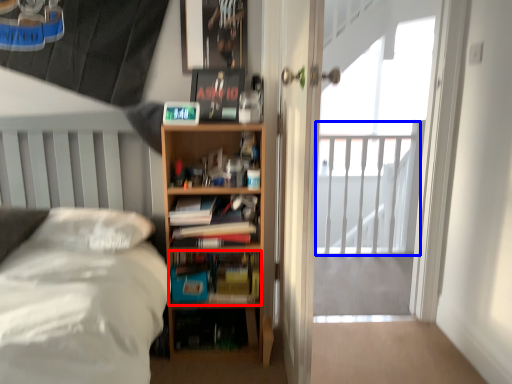
Question: Which of the following is the farthest to the observer, book (highlighted by a red box) or balcony (highlighted by a blue box)?

Choices:
 (A) book
 (B) balcony

Answer: (B)